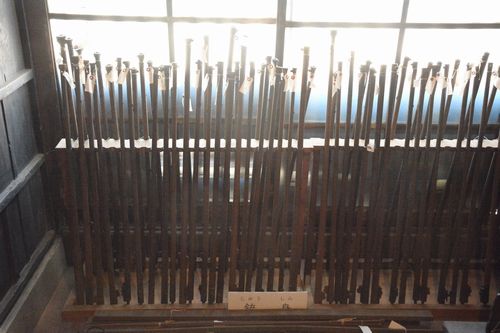
Locate an element on the screen. This screenshot has width=500, height=333. glass panes is located at coordinates (105, 36), (250, 29).